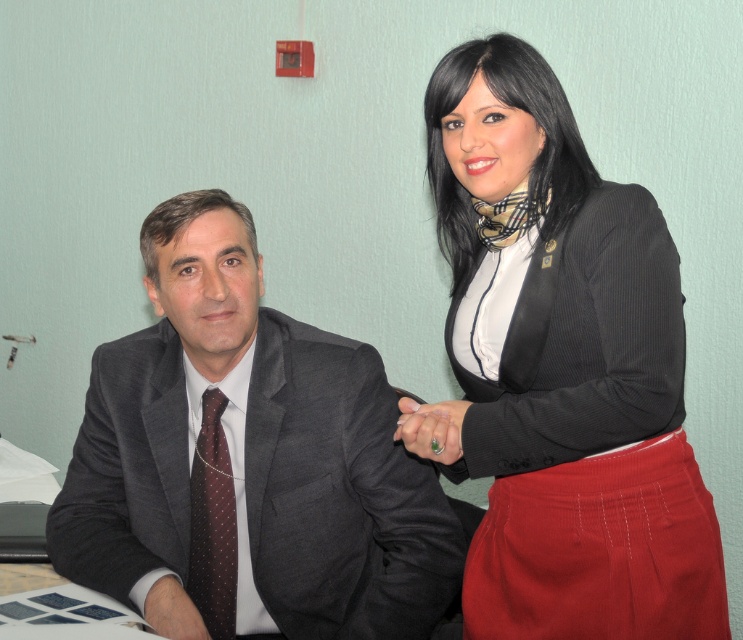
Is brown dotted tie at center to the right of green polished ring at center from the viewer's perspective?

Incorrect, brown dotted tie at center is not on the right side of green polished ring at center.

Between brown dotted tie at center and green polished ring at center, which one appears on the left side from the viewer's perspective?

brown dotted tie at center is more to the left.

Which is in front, point (221, 428) or point (444, 444)?

Point (444, 444) is in front.

Identify the location of brown dotted tie at center. Image resolution: width=743 pixels, height=640 pixels. (212, 524).

Is point (632, 268) positioned in front of point (215, 513)?

Yes, it is in front of point (215, 513).

Where is `matte black blazer at upper right`? matte black blazer at upper right is located at coordinates [x=565, y=371].

Where is `matte black blazer at upper right`? Image resolution: width=743 pixels, height=640 pixels. matte black blazer at upper right is located at coordinates (565, 371).

Where is `dark gray suit at left`? This screenshot has width=743, height=640. dark gray suit at left is located at coordinates (249, 458).

The height and width of the screenshot is (640, 743). Describe the element at coordinates (249, 458) in the screenshot. I see `dark gray suit at left` at that location.

Image resolution: width=743 pixels, height=640 pixels. Find the location of `dark gray suit at left`. dark gray suit at left is located at coordinates (249, 458).